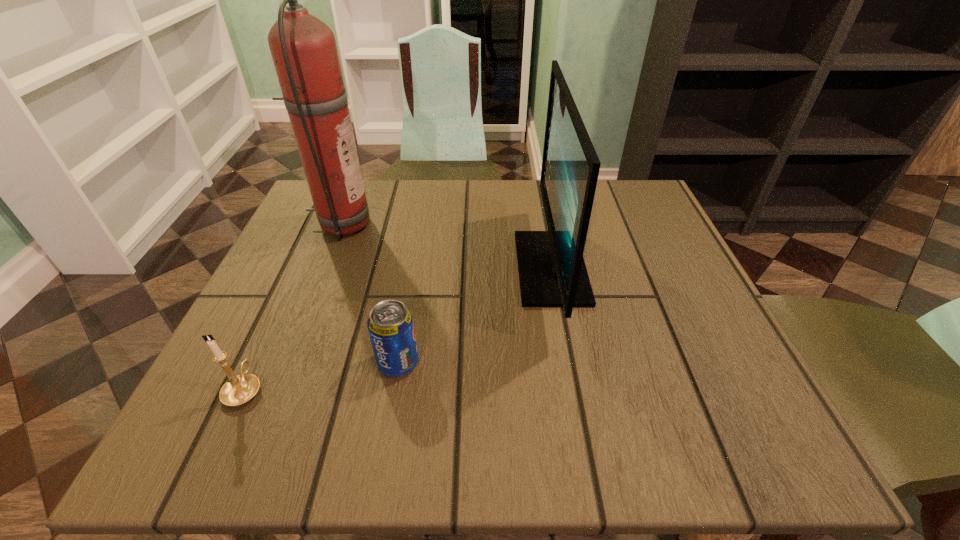
In the image, there is a desktop. Where is `vacant space at the far edge`? The image size is (960, 540). vacant space at the far edge is located at coordinates (476, 200).

This screenshot has height=540, width=960. Identify the location of vacant space at the near edge. (318, 427).

Where is `blank space at the right edge of the desktop`? blank space at the right edge of the desktop is located at coordinates (723, 349).

Locate an element on the screen. vacant space at the near left corner of the desktop is located at coordinates (282, 417).

Find the location of `vacant space at the far right corner`. vacant space at the far right corner is located at coordinates (656, 234).

In order to click on empty space between the rightmost object and the tallest object in this screenshot , I will do point(446,246).

The width and height of the screenshot is (960, 540). What are the coordinates of `free area in between the monitor and the second object from right to left` in the screenshot? It's located at (474, 315).

Image resolution: width=960 pixels, height=540 pixels. I want to click on free space between the third shortest object and the third object from left to right, so click(x=474, y=315).

Find the location of a particular element. Image resolution: width=960 pixels, height=540 pixels. free area in between the soda and the second tallest object is located at coordinates (474, 315).

You are a GUI agent. You are given a task and a screenshot of the screen. Output one action in this format:
    pyautogui.click(x=<x>, y=<y>)
    Task: Click on the vacant space that's between the third shortest object and the second object from right to left
    This screenshot has width=960, height=540.
    Given the screenshot: What is the action you would take?
    pyautogui.click(x=474, y=315)